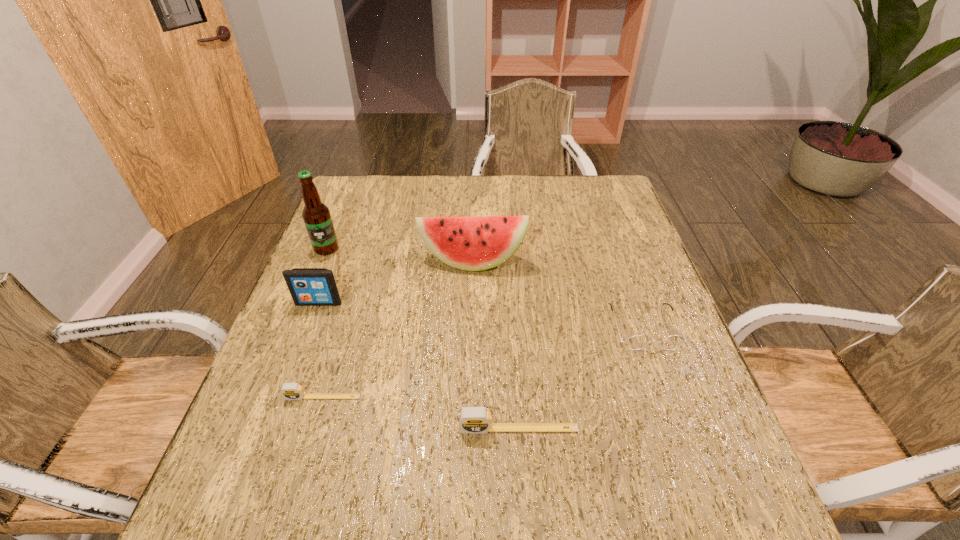
This screenshot has width=960, height=540. In order to click on free region at the left edge of the desktop in this screenshot , I will do `click(300, 313)`.

This screenshot has width=960, height=540. I want to click on free space at the right edge of the desktop, so click(657, 298).

The height and width of the screenshot is (540, 960). In the image, there is a desktop. What are the coordinates of `vacant region at the far left corner` in the screenshot? It's located at (359, 214).

Where is `blank area at the far right corner`? The height and width of the screenshot is (540, 960). blank area at the far right corner is located at coordinates (591, 203).

Find the location of a particular element. unoccupied area between the spectacles and the shorter tape measure is located at coordinates (483, 362).

Identify the location of vacant space that is in between the fourth shortest object and the second nearest object. click(321, 350).

Locate an element on the screen. The height and width of the screenshot is (540, 960). vacant space that's between the fifth farthest object and the iPod is located at coordinates (321, 350).

I want to click on free space between the watermelon and the taller tape measure, so click(x=495, y=345).

Where is `vacant space that is in between the right tape measure and the spectacles`? vacant space that is in between the right tape measure and the spectacles is located at coordinates (581, 378).

Locate an element on the screen. Image resolution: width=960 pixels, height=540 pixels. free spot between the watermelon and the farther tape measure is located at coordinates point(397,329).